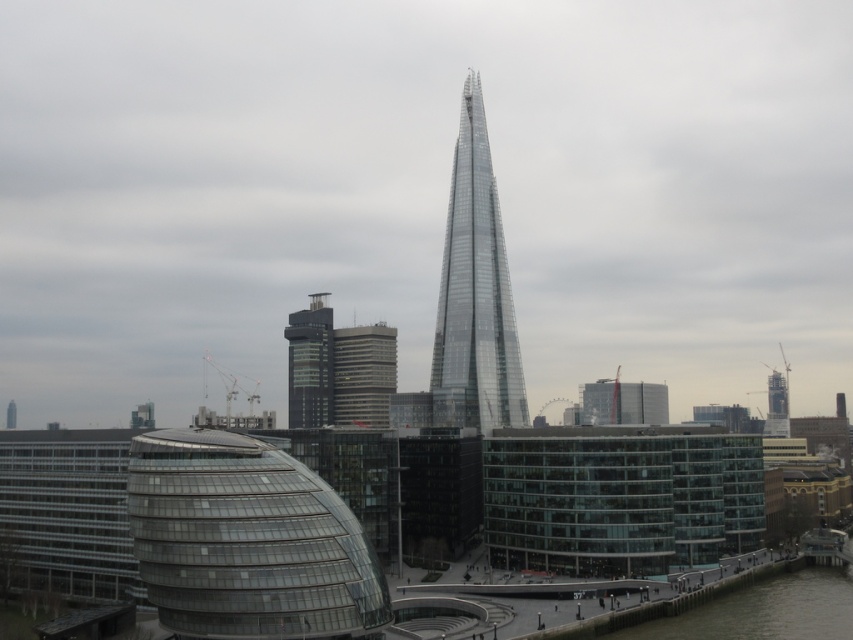
Question: Which object is closer to the camera taking this photo?

Choices:
 (A) transparent glass tower at center
 (B) matte glass building at center
 (C) black glass tower at center

Answer: (A)

Question: Is transparent glass tower at center bigger than black glass tower at center?

Choices:
 (A) no
 (B) yes

Answer: (B)

Question: Which object appears farthest from the camera in this image?

Choices:
 (A) black glass tower at center
 (B) clear water at lower right

Answer: (A)

Question: Is transparent glass tower at center in front of clear water at lower right?

Choices:
 (A) yes
 (B) no

Answer: (B)

Question: Which object appears closest to the camera in this image?

Choices:
 (A) black glass tower at center
 (B) clear water at lower right
 (C) transparent glass tower at center
 (D) matte glass building at center

Answer: (B)

Question: Is matte glass building at center positioned before black glass tower at center?

Choices:
 (A) yes
 (B) no

Answer: (A)